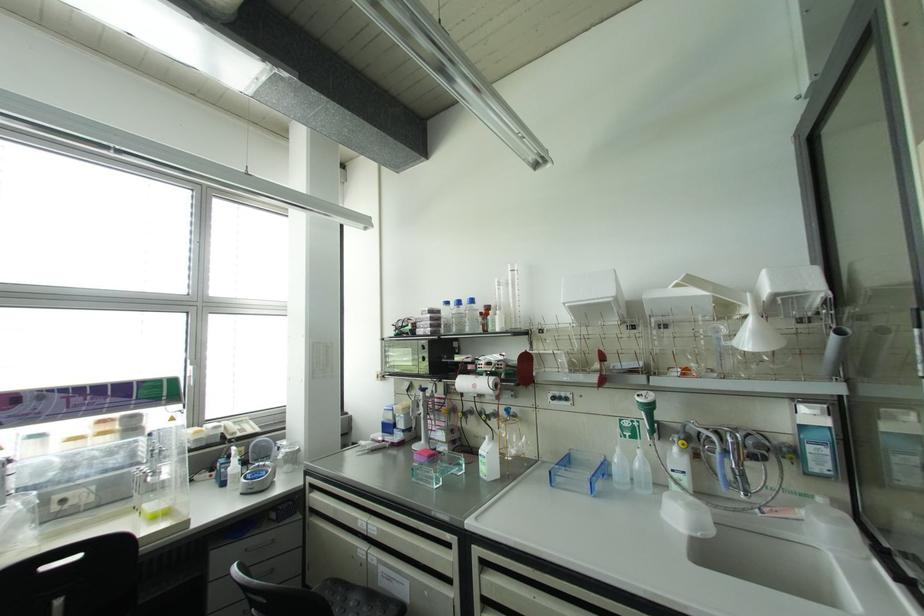
What are the coordinates of `wall dispenser lever` in the screenshot? It's located at 648,411.